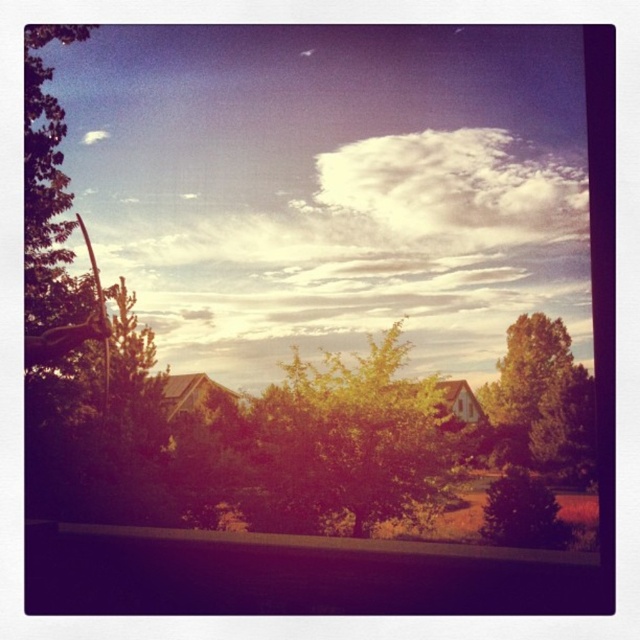
You are standing in the outdoor scene and want to take a photo of both the green leafy tree at right and the green matte tree at lower right. Which tree should you focus on first if you want to capture both in the same frame without moving the camera?

The green leafy tree at right is taller than the green matte tree at lower right, so you should focus on the green leafy tree at right first to ensure it fits within the frame.

You are an artist trying to paint the scene. You want to ensure the white fluffy cloud at upper center and the green matte tree at lower right are proportionally accurate. Which object should you make larger in your painting?

The white fluffy cloud at upper center should be made larger than the green matte tree at lower right because it is described as larger in size.